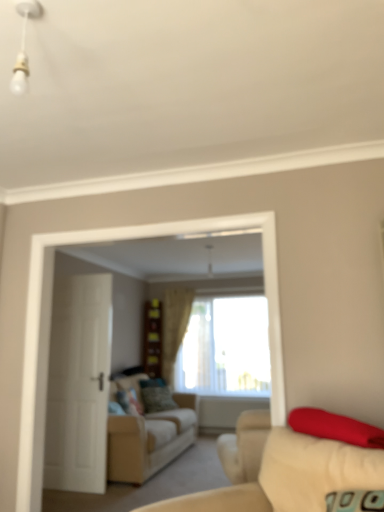
Question: Is white glossy bulb at upper left closer to the viewer compared to velvet green pillow at center, which is the second pillow from front to back?

Choices:
 (A) no
 (B) yes

Answer: (B)

Question: Would you say white glossy bulb at upper left contains velvet green pillow at center, which is the second pillow from front to back?

Choices:
 (A) no
 (B) yes

Answer: (A)

Question: From the image's perspective, is white glossy bulb at upper left on velvet green pillow at center, which is the second pillow from bottom to top?

Choices:
 (A) no
 (B) yes

Answer: (B)

Question: Could you tell me if white glossy bulb at upper left is turned towards velvet green pillow at center, placed as the 2th pillow when sorted from top to bottom?

Choices:
 (A) yes
 (B) no

Answer: (B)

Question: Is white glossy bulb at upper left outside velvet green pillow at center, which ranks as the first pillow in left-to-right order?

Choices:
 (A) no
 (B) yes

Answer: (B)

Question: Considering the positions of wooden dresser at center and beige fabric couch at lower right, the second studio couch when ordered from bottom to top, in the image, is wooden dresser at center taller or shorter than beige fabric couch at lower right, the second studio couch when ordered from bottom to top,?

Choices:
 (A) short
 (B) tall

Answer: (B)

Question: Which is correct: wooden dresser at center is inside beige fabric couch at lower right, arranged as the 1th studio couch when viewed from the top, or outside of it?

Choices:
 (A) inside
 (B) outside

Answer: (B)

Question: Based on their positions, is wooden dresser at center located to the left or right of beige fabric couch at lower right, the second studio couch when ordered from bottom to top?

Choices:
 (A) left
 (B) right

Answer: (A)

Question: Considering their positions, is wooden dresser at center located in front of or behind beige fabric couch at lower right, the second studio couch when ordered from bottom to top?

Choices:
 (A) behind
 (B) front

Answer: (A)

Question: Considering the positions of velvet green pillow at center, placed as the second pillow when sorted from back to front, and white matte door at left in the image, is velvet green pillow at center, placed as the second pillow when sorted from back to front, wider or thinner than white matte door at left?

Choices:
 (A) thin
 (B) wide

Answer: (B)

Question: Considering the positions of velvet green pillow at center, which is the second pillow from front to back, and white matte door at left in the image, is velvet green pillow at center, which is the second pillow from front to back, taller or shorter than white matte door at left?

Choices:
 (A) tall
 (B) short

Answer: (B)

Question: From the image's perspective, relative to white matte door at left, is velvet green pillow at center, which is the second pillow from bottom to top, above or below?

Choices:
 (A) below
 (B) above

Answer: (A)

Question: Does point (119, 396) appear closer or farther from the camera than point (51, 402)?

Choices:
 (A) farther
 (B) closer

Answer: (A)

Question: Looking at their shapes, would you say white matte door at left is wider or thinner than beige fabric curtain at center?

Choices:
 (A) wide
 (B) thin

Answer: (B)

Question: Does point (84, 332) appear closer or farther from the camera than point (173, 312)?

Choices:
 (A) closer
 (B) farther

Answer: (A)